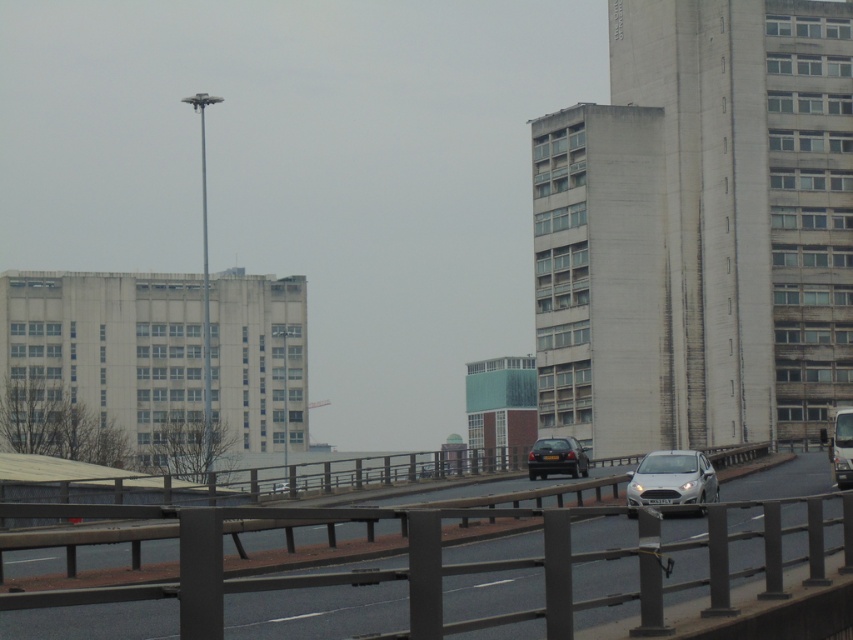
Question: Among these points, which one is nearest to the camera?

Choices:
 (A) (x=668, y=461)
 (B) (x=556, y=472)
 (C) (x=753, y=468)

Answer: (A)

Question: In this image, where is metallic gray highway at center located relative to black glossy car at center?

Choices:
 (A) below
 (B) above

Answer: (B)

Question: Can you confirm if metallic gray highway at center is positioned above black glossy car at center?

Choices:
 (A) no
 (B) yes

Answer: (B)

Question: Can you confirm if metallic gray highway at center is bigger than silver metallic car at center?

Choices:
 (A) yes
 (B) no

Answer: (A)

Question: Which object is farther from the camera taking this photo?

Choices:
 (A) silver metallic car at center
 (B) black glossy car at center
 (C) metallic gray highway at center

Answer: (B)

Question: Which point is farther to the camera?

Choices:
 (A) silver metallic car at center
 (B) black glossy car at center

Answer: (B)